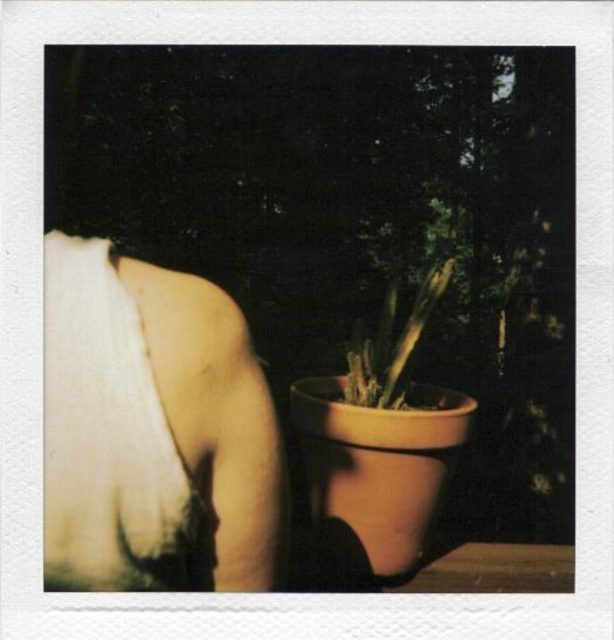
You are a photographer setting up a shoot in a dimly lit room with a vintage filter. You notice the white cotton bandage at upper left and the matte clay pot at center. Which object is closer to the camera?

The white cotton bandage at upper left is positioned under the matte clay pot at center, meaning the matte clay pot at center is closer to the camera.

You are a photographer who wants to take a closeup shot of the matte clay pot at center. However, the white cotton bandage at upper left is blocking your view. Can you estimate if the bandage is smaller than the pot?

The white cotton bandage at upper left has a smaller size compared to matte clay pot at center, so yes, the bandage is smaller than the pot and might be easier to move out of the way for a clear shot.